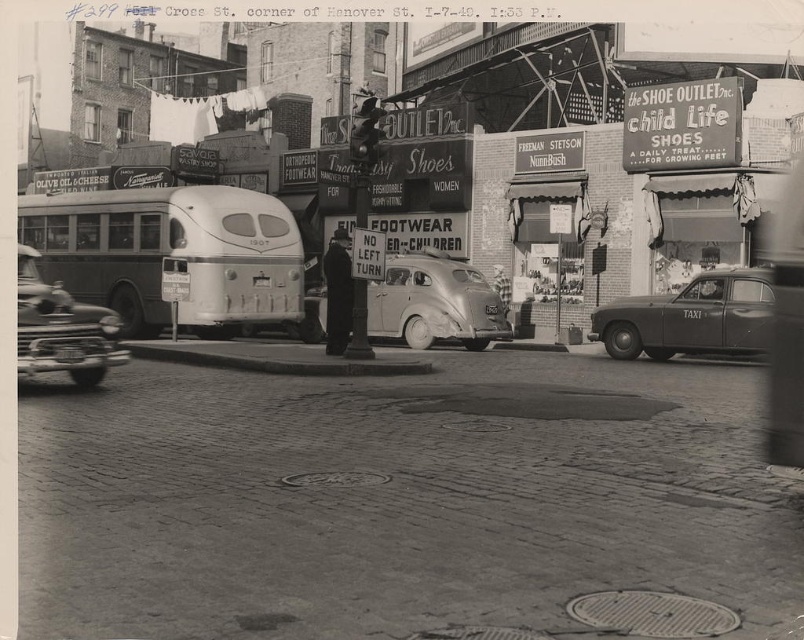
The height and width of the screenshot is (640, 804). Describe the element at coordinates (171, 253) in the screenshot. I see `metallic silver bus at left` at that location.

Who is more distant from viewer, (x=302, y=320) or (x=737, y=336)?

The point (x=302, y=320) is more distant.

Measure the distance between metallic silver bus at left and camera.

metallic silver bus at left is 20.77 meters from camera.

Find the location of a particular element. Image resolution: width=804 pixels, height=640 pixels. metallic silver bus at left is located at coordinates (171, 253).

Is metallic silver bus at left below shiny chrome sedan at lower left?

Yes.

Which is in front, point (195, 291) or point (21, 244)?

Point (195, 291) is more forward.

Which is in front, point (298, 259) or point (21, 320)?

Point (21, 320) is more forward.

Where is `metallic silver bus at left`? Image resolution: width=804 pixels, height=640 pixels. metallic silver bus at left is located at coordinates (171, 253).

Which of these two, shiny silver sedan at center or shiny chrome sedan at lower left, stands taller?

shiny silver sedan at center is taller.

Which of these two, shiny silver sedan at center or shiny chrome sedan at lower left, stands shorter?

With less height is shiny chrome sedan at lower left.

What do you see at coordinates (433, 301) in the screenshot?
I see `shiny silver sedan at center` at bounding box center [433, 301].

The height and width of the screenshot is (640, 804). I want to click on shiny silver sedan at center, so click(x=433, y=301).